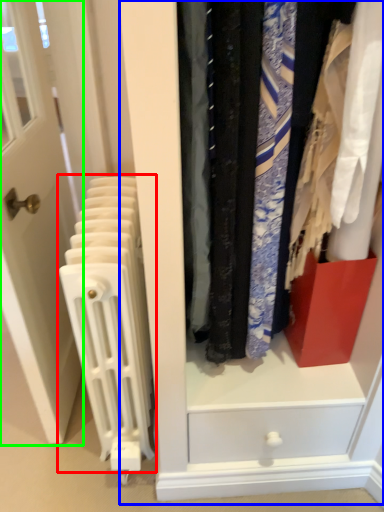
Question: Which is farther away from radiator (highlighted by a red box)? dresser (highlighted by a blue box) or door (highlighted by a green box)?

Choices:
 (A) dresser
 (B) door

Answer: (A)